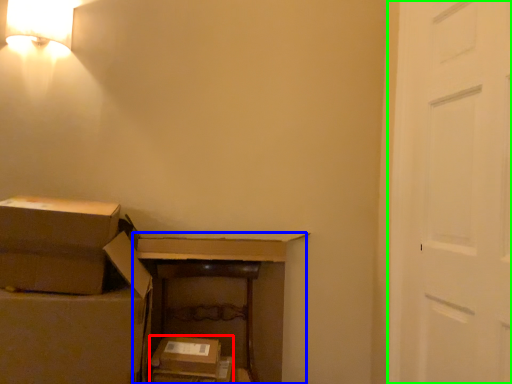
Question: Which object is the closest to the storage box (highlighted by a red box)? Choose among these: dresser (highlighted by a blue box) or door (highlighted by a green box).

Choices:
 (A) dresser
 (B) door

Answer: (A)